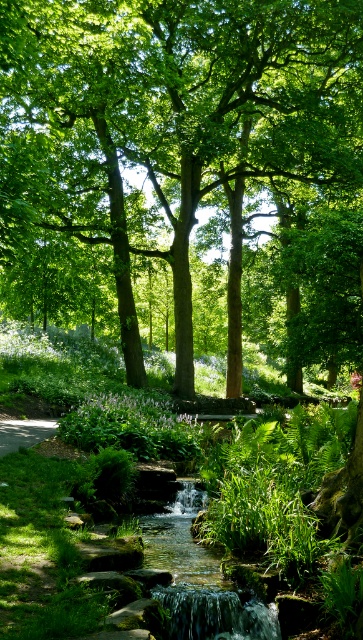
From the picture: You are planning to install a small bench along the smooth concrete path at lower left. The bench requires a minimum of 15 meters of space between it and any nearby trees to avoid root interference. Based on the scene, will the green leafy tree at center allow for this installation?

The green leafy tree at center is 17.02 meters from the smooth concrete path at lower left. Since the required minimum distance is 15 meters, the tree is far enough away to allow the bench installation without root interference.

You are standing at the origin point of the coordinate system. You want to walk towards the green leafy tree at center. Which direction should you move in?

The green leafy tree at center is located at coordinate point 0.186 on the x axis and 0.466 on the y axis. Since you are at the origin, you should move in the positive x and positive y direction to reach it.